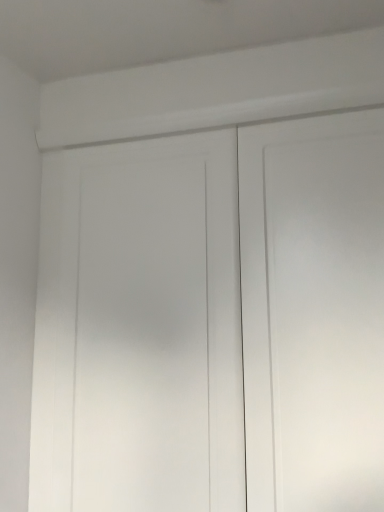
This screenshot has width=384, height=512. I want to click on white matte door at center, so click(213, 321).

In order to face white matte door at center, should I rotate leftwards or rightwards?

To align with it, rotate right about 4.315°.

Describe the element at coordinates (213, 321) in the screenshot. I see `white matte door at center` at that location.

This screenshot has width=384, height=512. I want to click on white matte door at center, so click(x=213, y=321).